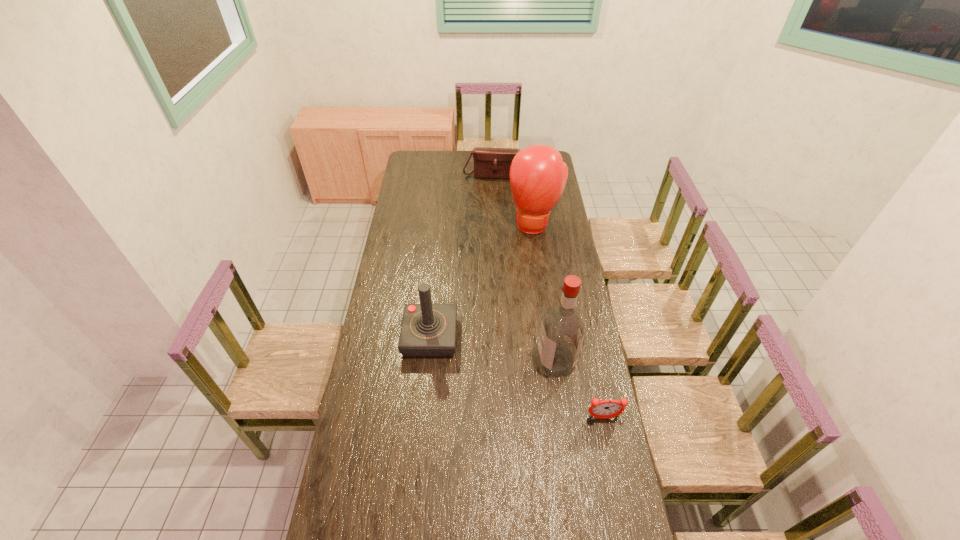
In order to click on alarm clock that is at the right edge in this screenshot , I will do 608,408.

At what (x,y) coordinates should I click in order to perform the action: click on boxing glove located at the right edge. Please return your answer as a coordinate pair (x, y). This screenshot has width=960, height=540. Looking at the image, I should click on (538, 175).

This screenshot has width=960, height=540. What are the coordinates of `liquor located in the right edge section of the desktop` in the screenshot? It's located at (562, 331).

Find the location of a particular element. The width and height of the screenshot is (960, 540). vacant region at the far edge of the desktop is located at coordinates (455, 170).

In the image, there is a desktop. Where is `vacant space at the near edge`? vacant space at the near edge is located at coordinates (505, 518).

The height and width of the screenshot is (540, 960). Identify the location of vacant space at the left edge of the desktop. (366, 454).

You are a GUI agent. You are given a task and a screenshot of the screen. Output one action in this format:
    pyautogui.click(x=<x>, y=<y>)
    Task: Click on the free space at the right edge of the desktop
    The width and height of the screenshot is (960, 540).
    Given the screenshot: What is the action you would take?
    pyautogui.click(x=564, y=401)

The image size is (960, 540). Identify the location of vacant region at the far left corner. (421, 163).

Find the location of a particular element. The image size is (960, 540). vacant area that lies between the third shortest object and the farthest object is located at coordinates (463, 255).

Where is `vacant point located between the alarm clock and the liquor`? The image size is (960, 540). vacant point located between the alarm clock and the liquor is located at coordinates point(580,389).